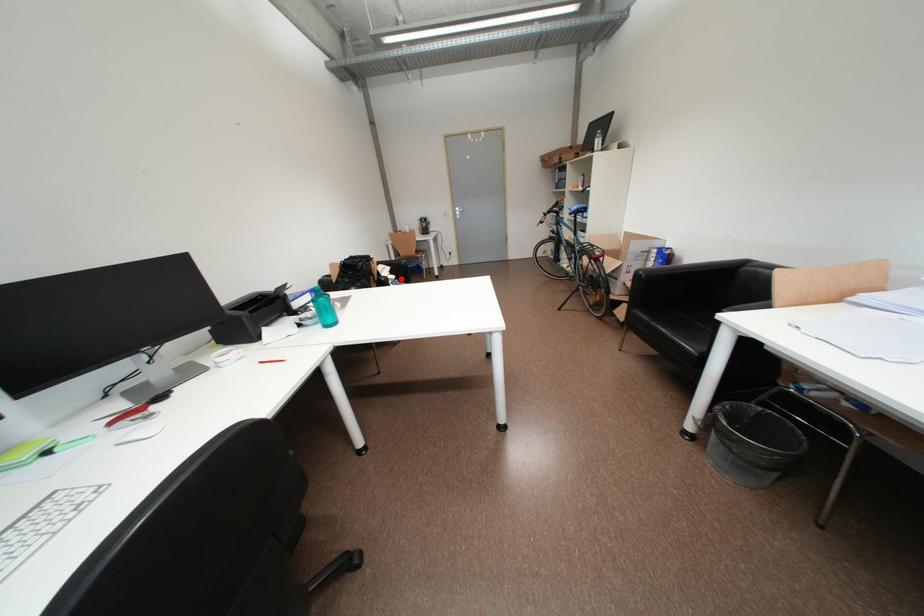
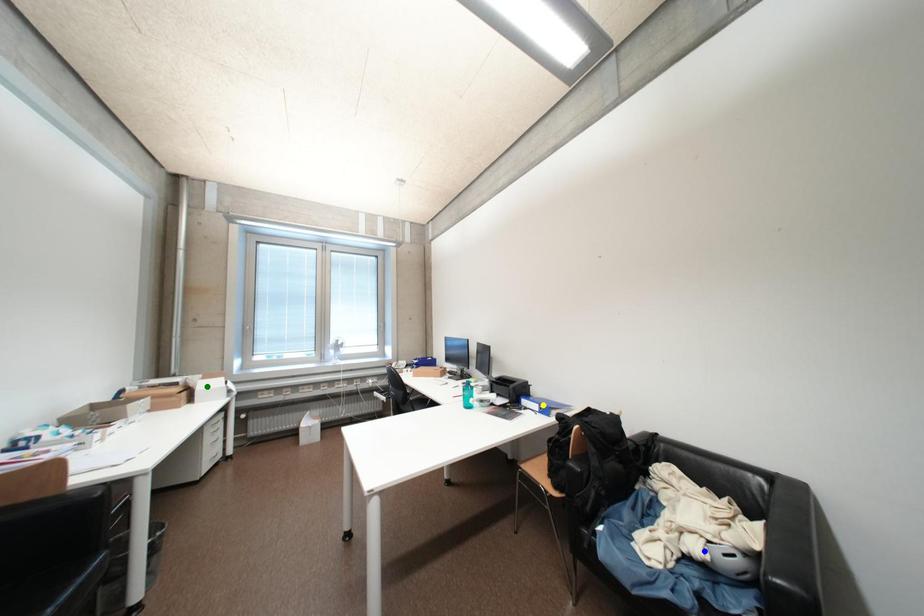
Question: I am providing you with two images of the same scene from different viewpoints. A red point is marked on the first image. You are given multiple points on the second image. Which mark in image 2 goes with the point in image 1?

Choices:
 (A) yellow point
 (B) blue point
 (C) green point

Answer: (B)